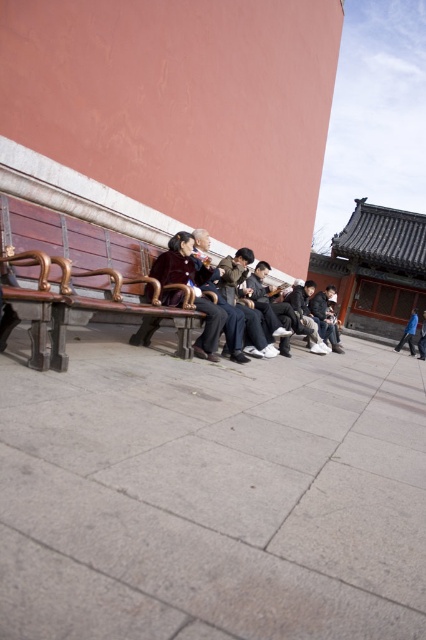
You are standing at the point labeled point (199, 346). You want to walk to the point labeled point (157, 278). Which direction should you face to walk directly towards it?

You should face towards the direction opposite of point (199, 346) to walk directly towards point (157, 278) since it is in front of point (199, 346).